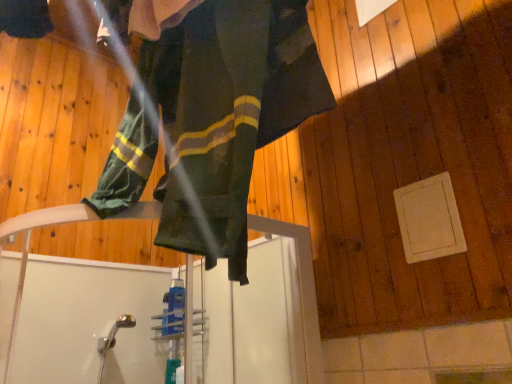
Question: Based on their positions, is white matte panel at lower right located to the left or right of green fabric pants at center?

Choices:
 (A) right
 (B) left

Answer: (A)

Question: From a real-world perspective, is white matte panel at lower right positioned above or below green fabric pants at center?

Choices:
 (A) above
 (B) below

Answer: (B)

Question: Considering the positions of point (450, 221) and point (205, 162), is point (450, 221) closer or farther from the camera than point (205, 162)?

Choices:
 (A) farther
 (B) closer

Answer: (A)

Question: Based on their sizes in the image, would you say green fabric pants at center is bigger or smaller than white matte panel at lower right?

Choices:
 (A) small
 (B) big

Answer: (B)

Question: Choose the correct answer: Is green fabric pants at center inside white matte panel at lower right or outside it?

Choices:
 (A) inside
 (B) outside

Answer: (B)

Question: Considering their positions, is green fabric pants at center located in front of or behind white matte panel at lower right?

Choices:
 (A) behind
 (B) front

Answer: (B)

Question: From their relative heights in the image, would you say green fabric pants at center is taller or shorter than white matte panel at lower right?

Choices:
 (A) short
 (B) tall

Answer: (B)